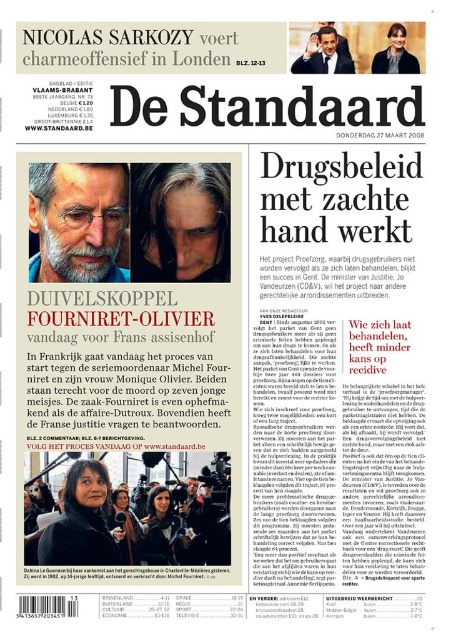
Can you confirm if gray hair at center is positioned below matte black suit at upper center?

Indeed, gray hair at center is positioned under matte black suit at upper center.

What do you see at coordinates (77, 220) in the screenshot? I see `gray hair at center` at bounding box center [77, 220].

Identify the location of gray hair at center. (77, 220).

Is matte black hair at upper center positioned behind matte black face at upper center?

No, it is in front of matte black face at upper center.

Can you confirm if matte black hair at upper center is smaller than matte black face at upper center?

Actually, matte black hair at upper center might be larger than matte black face at upper center.

This screenshot has height=640, width=456. Identify the location of matte black hair at upper center. (82, 522).

Who is more forward, (x=102, y=262) or (x=397, y=36)?

Point (x=397, y=36)

Can you confirm if gray hair at center is bigger than matte black face at upper center?

Yes.

What do you see at coordinates (77, 220) in the screenshot? This screenshot has width=456, height=640. I see `gray hair at center` at bounding box center [77, 220].

Where is `gray hair at center`? The image size is (456, 640). gray hair at center is located at coordinates (77, 220).